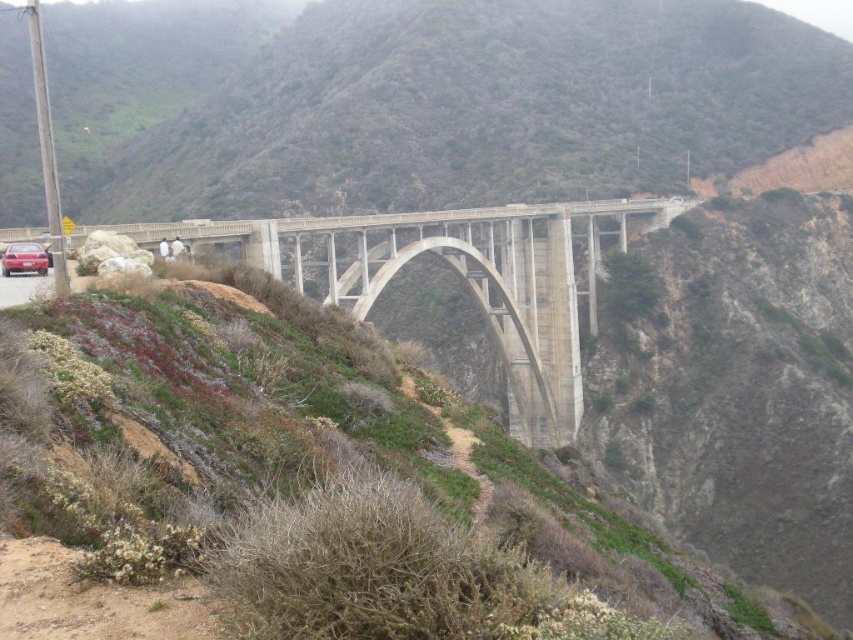
Question: Does concrete bridge at center have a smaller size compared to matte red car at lower left?

Choices:
 (A) no
 (B) yes

Answer: (A)

Question: Which is farther from the concrete bridge at center?

Choices:
 (A) shiny red sedan at lower left
 (B) matte red car at lower left

Answer: (B)

Question: Is matte red car at lower left to the right of shiny red sedan at lower left from the viewer's perspective?

Choices:
 (A) no
 (B) yes

Answer: (B)

Question: Which point is closer to the camera?

Choices:
 (A) matte red car at lower left
 (B) concrete bridge at center

Answer: (A)

Question: Does concrete bridge at center have a smaller size compared to shiny red sedan at lower left?

Choices:
 (A) no
 (B) yes

Answer: (A)

Question: Estimate the real-world distances between objects in this image. Which object is closer to the matte red car at lower left?

Choices:
 (A) concrete bridge at center
 (B) shiny red sedan at lower left

Answer: (B)